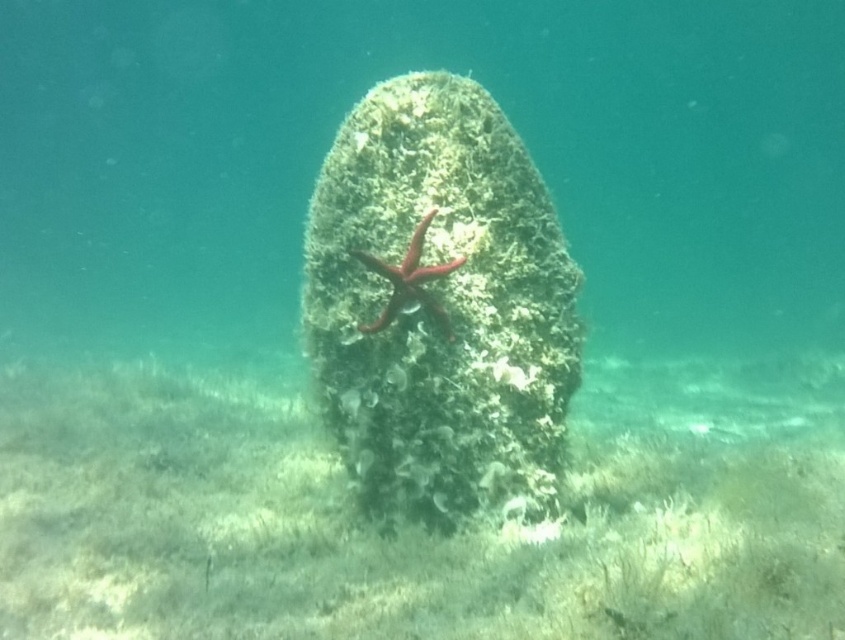
Does greenish stone at center appear over red matte starfish at center?

Yes, greenish stone at center is above red matte starfish at center.

Does greenish stone at center come in front of red matte starfish at center?

That is False.

The width and height of the screenshot is (845, 640). I want to click on greenish stone at center, so click(x=440, y=307).

Which is more to the right, greenish-brown textured rock at center or red matte starfish at center?

greenish-brown textured rock at center

Is point (75, 456) less distant than point (444, 310)?

No, it is not.

Is point (229, 621) closer to camera compared to point (402, 269)?

Yes, point (229, 621) is in front of point (402, 269).

What are the coordinates of `greenish-brown textured rock at center` in the screenshot? It's located at (413, 525).

Is greenish-brown textured rock at center to the left of greenish stone at center from the viewer's perspective?

In fact, greenish-brown textured rock at center is to the right of greenish stone at center.

Between greenish-brown textured rock at center and greenish stone at center, which one has more height?

greenish stone at center is taller.

Is point (173, 540) positioned before point (466, 477)?

No.

I want to click on greenish-brown textured rock at center, so click(x=413, y=525).